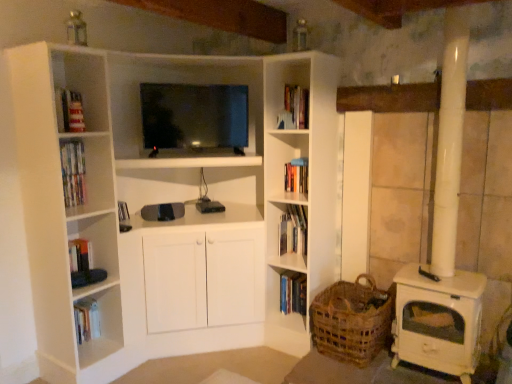
Locate an element on the screen. The width and height of the screenshot is (512, 384). woven brown basket at lower right is located at coordinates (352, 320).

What is the approximate width of hardcover book at center, the 2th book in the top-to-bottom sequence?

The width of hardcover book at center, the 2th book in the top-to-bottom sequence, is 9.91 inches.

Describe the element at coordinates (194, 118) in the screenshot. I see `matte black tv at center` at that location.

You are a GUI agent. You are given a task and a screenshot of the screen. Output one action in this format:
    pyautogui.click(x=<x>, y=<y>)
    Task: Click on the woven brown basket at lower right
    The image size is (512, 384).
    Given the screenshot: What is the action you would take?
    pos(352,320)

Is the depth of woven brown basket at lower right less than that of hardcover book at center, arranged as the first book when viewed from the top?

Yes.

Considering the sizes of woven brown basket at lower right and hardcover book at center, arranged as the first book when viewed from the top, in the image, is woven brown basket at lower right bigger or smaller than hardcover book at center, arranged as the first book when viewed from the top,?

Considering their sizes, woven brown basket at lower right takes up more space than hardcover book at center, arranged as the first book when viewed from the top.

From the woven brown basket at lower right, count 1st books backward and point to it. Please provide its 2D coordinates.

[(293, 230)]

From the image's perspective, is woven brown basket at lower right on top of hardcover book at center, arranged as the first book when viewed from the top?

No, from the image's perspective, woven brown basket at lower right is not over hardcover book at center, arranged as the first book when viewed from the top.

Is hardcover book at center, which is the first book in bottom-to-top order, aimed at matte black tv at center?

No, hardcover book at center, which is the first book in bottom-to-top order, is not facing towards matte black tv at center.

Consider the image. Is hardcover book at center, the 2th book in the top-to-bottom sequence, wider than matte black tv at center?

In fact, hardcover book at center, the 2th book in the top-to-bottom sequence, might be narrower than matte black tv at center.

Considering the points (292, 277) and (173, 117), which point is in front, point (292, 277) or point (173, 117)?

Point (173, 117)

Between hardcover book at center, which is the first book in bottom-to-top order, and matte black tv at center, which one is positioned in front?

Positioned in front is matte black tv at center.

In the image, is matte black tv at center on the left side or the right side of woven brown basket at lower right?

matte black tv at center is positioned on woven brown basket at lower right's left side.

Does matte black tv at center contain woven brown basket at lower right?

Definitely not — woven brown basket at lower right is not inside matte black tv at center.

Does matte black tv at center turn towards woven brown basket at lower right?

No, matte black tv at center is not oriented towards woven brown basket at lower right.

Is matte black tv at center positioned behind woven brown basket at lower right?

Yes, it is behind woven brown basket at lower right.

Considering the positions of point (283, 286) and point (367, 330), is point (283, 286) closer or farther from the camera than point (367, 330)?

Point (283, 286) is positioned farther from the camera compared to point (367, 330).

Is hardcover book at center, the 2th book in the top-to-bottom sequence, positioned behind woven brown basket at lower right?

Yes, hardcover book at center, the 2th book in the top-to-bottom sequence, is behind woven brown basket at lower right.

From a real-world perspective, who is located higher, hardcover book at center, the 2th book in the top-to-bottom sequence, or woven brown basket at lower right?

In real-world perspective, woven brown basket at lower right is above.

In the scene shown: Are hardcover book at center, the 2th book in the top-to-bottom sequence, and woven brown basket at lower right beside each other?

hardcover book at center, the 2th book in the top-to-bottom sequence, and woven brown basket at lower right are not in contact.

Considering the sizes of woven brown basket at lower right and matte black tv at center in the image, is woven brown basket at lower right bigger or smaller than matte black tv at center?

Considering their sizes, woven brown basket at lower right takes up less space than matte black tv at center.

From a real-world perspective, is woven brown basket at lower right below matte black tv at center?

Yes, from a real-world perspective, woven brown basket at lower right is under matte black tv at center.

Would you say woven brown basket at lower right is a long distance from matte black tv at center?

Yes, woven brown basket at lower right and matte black tv at center are located far from each other.

From a real-world perspective, relative to matte black tv at center, is hardcover book at center, arranged as the first book when viewed from the top, vertically above or below?

From a real-world perspective, hardcover book at center, arranged as the first book when viewed from the top, is physically below matte black tv at center.

How distant is hardcover book at center, arranged as the first book when viewed from the top, from matte black tv at center?

33.68 inches.

Does hardcover book at center, arranged as the first book when viewed from the top, have a lesser width compared to matte black tv at center?

Yes, hardcover book at center, arranged as the first book when viewed from the top, is thinner than matte black tv at center.

In the scene shown: Can you see hardcover book at center, arranged as the first book when viewed from the top, touching matte black tv at center?

There is a gap between hardcover book at center, arranged as the first book when viewed from the top, and matte black tv at center.

Is the surface of hardcover book at center, which is the first book in bottom-to-top order, in direct contact with hardcover book at center, arranged as the first book when viewed from the top?

No, hardcover book at center, which is the first book in bottom-to-top order, is not touching hardcover book at center, arranged as the first book when viewed from the top.

Considering the positions of objects hardcover book at center, the 2th book in the top-to-bottom sequence, and hardcover book at center, arranged as the first book when viewed from the top, in the image provided, who is more to the right, hardcover book at center, the 2th book in the top-to-bottom sequence, or hardcover book at center, arranged as the first book when viewed from the top,?

hardcover book at center, the 2th book in the top-to-bottom sequence, is more to the right.

Looking at this image, is hardcover book at center, which is the first book in bottom-to-top order, located outside hardcover book at center, arranged as the first book when viewed from the top?

Absolutely, hardcover book at center, which is the first book in bottom-to-top order, is external to hardcover book at center, arranged as the first book when viewed from the top.

From the image's perspective, is hardcover book at center, which is the first book in bottom-to-top order, above hardcover book at center, arranged as the first book when viewed from the top?

No, from the image's perspective, hardcover book at center, which is the first book in bottom-to-top order, is not on top of hardcover book at center, arranged as the first book when viewed from the top.

This screenshot has width=512, height=384. Identify the location of the 2nd book counting from the left of the woven brown basket at lower right. (293, 230).

There is a matte black tv at center. Where is `the 2nd book below it (from a real-world perspective)`? Image resolution: width=512 pixels, height=384 pixels. the 2nd book below it (from a real-world perspective) is located at coordinates (293, 293).

Consider the image. Based on their spatial positions, is hardcover book at center, which is the first book in bottom-to-top order, or woven brown basket at lower right closer to matte black tv at center?

The object closer to matte black tv at center is hardcover book at center, which is the first book in bottom-to-top order.

Considering their positions, is woven brown basket at lower right positioned closer to hardcover book at center, arranged as the first book when viewed from the top, than matte black tv at center?

woven brown basket at lower right lies closer to hardcover book at center, arranged as the first book when viewed from the top, than the other object.

Looking at the image, which one is located closer to hardcover book at center, which is the first book in bottom-to-top order, matte black tv at center or hardcover book at center, arranged as the first book when viewed from the top?

hardcover book at center, arranged as the first book when viewed from the top.

Which object lies nearer to the anchor point woven brown basket at lower right, matte black tv at center or hardcover book at center, arranged as the first book when viewed from the top?

hardcover book at center, arranged as the first book when viewed from the top.

Estimate the real-world distances between objects in this image. Which object is closer to hardcover book at center, which is counted as the 2th book, starting from the bottom, matte black tv at center or woven brown basket at lower right?

woven brown basket at lower right is positioned closer to the anchor hardcover book at center, which is counted as the 2th book, starting from the bottom.

Estimate the real-world distances between objects in this image. Which object is further from matte black tv at center, hardcover book at center, the 2th book in the top-to-bottom sequence, or hardcover book at center, which is counted as the 2th book, starting from the bottom?

hardcover book at center, the 2th book in the top-to-bottom sequence, is positioned further to the anchor matte black tv at center.

When comparing their distances from matte black tv at center, does woven brown basket at lower right or hardcover book at center, which is the first book in bottom-to-top order, seem further?

woven brown basket at lower right.

Estimate the real-world distances between objects in this image. Which object is further from hardcover book at center, which is the first book in bottom-to-top order, matte black tv at center or woven brown basket at lower right?

The object further to hardcover book at center, which is the first book in bottom-to-top order, is matte black tv at center.

Locate an element on the screen. The height and width of the screenshot is (384, 512). book that lies between matte black tv at center and hardcover book at center, which is the first book in bottom-to-top order, from top to bottom is located at coordinates (293, 230).

Locate an element on the screen. This screenshot has height=384, width=512. book located between woven brown basket at lower right and hardcover book at center, which is the first book in bottom-to-top order, in the depth direction is located at coordinates (293, 230).